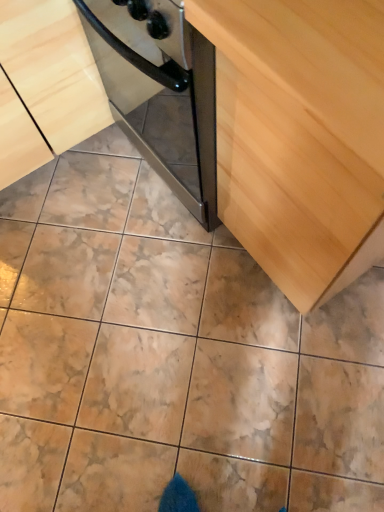
Question: In the image, is light wood cabinet at center, the first cabinetry from the right, positioned in front of or behind light wood cabinet at center, which is the 2th cabinetry from right to left?

Choices:
 (A) behind
 (B) front

Answer: (B)

Question: From their relative heights in the image, would you say light wood cabinet at center, arranged as the second cabinetry when viewed from the left, is taller or shorter than light wood cabinet at center, which is the 2th cabinetry from right to left?

Choices:
 (A) short
 (B) tall

Answer: (B)

Question: Looking at their shapes, would you say light wood cabinet at center, the first cabinetry from the right, is wider or thinner than light wood cabinet at center, which is the 2th cabinetry from right to left?

Choices:
 (A) wide
 (B) thin

Answer: (A)

Question: From the image's perspective, is light wood cabinet at center, which is the 2th cabinetry from right to left, above or below light wood cabinet at center, arranged as the second cabinetry when viewed from the left?

Choices:
 (A) above
 (B) below

Answer: (A)

Question: Is light wood cabinet at center, arranged as the 1th cabinetry when viewed from the left, spatially inside light wood cabinet at center, arranged as the second cabinetry when viewed from the left, or outside of it?

Choices:
 (A) inside
 (B) outside

Answer: (B)

Question: In the image, is light wood cabinet at center, which is the 2th cabinetry from right to left, positioned in front of or behind light wood cabinet at center, arranged as the second cabinetry when viewed from the left?

Choices:
 (A) front
 (B) behind

Answer: (B)

Question: Does point (52, 5) appear closer or farther from the camera than point (324, 133)?

Choices:
 (A) farther
 (B) closer

Answer: (A)